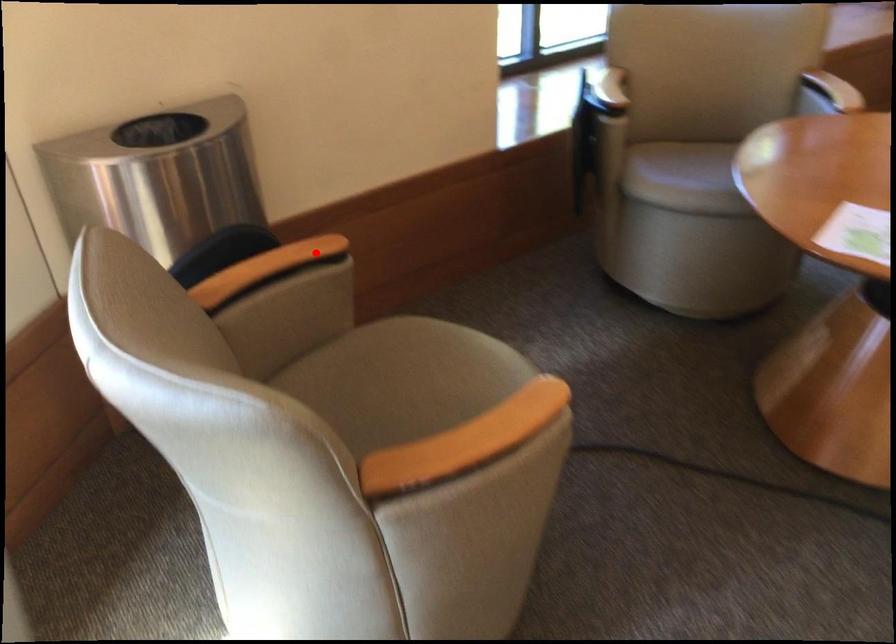
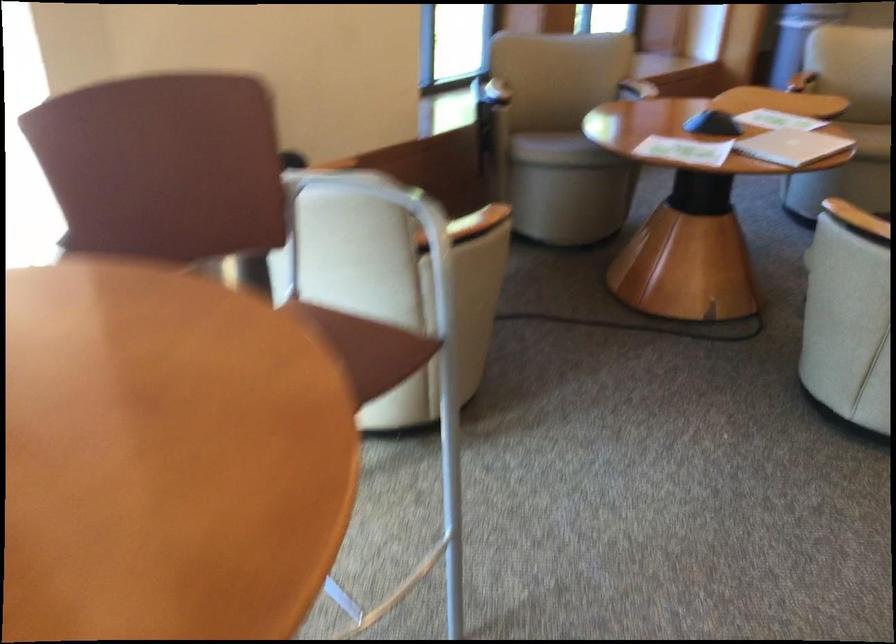
In the second image, find the point that corresponds to the highlighted location in the first image.

(333, 164)